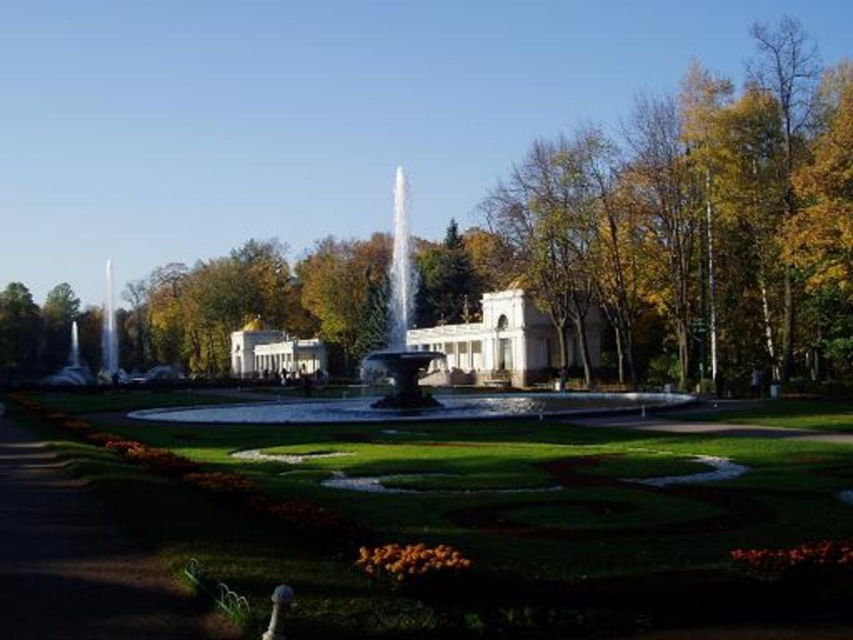
Question: Which point is closer to the camera?

Choices:
 (A) green grass at lower left
 (B) shiny silver fountain at center

Answer: (A)

Question: Is the position of green grass at lower left less distant than that of shiny silver fountain at center?

Choices:
 (A) yes
 (B) no

Answer: (A)

Question: Can you confirm if green grass at lower left is thinner than shiny silver fountain at center?

Choices:
 (A) yes
 (B) no

Answer: (B)

Question: Which point is closer to the camera?

Choices:
 (A) (20, 429)
 (B) (399, 340)

Answer: (A)

Question: Which object is farther from the camera taking this photo?

Choices:
 (A) green grass at lower left
 (B) shiny silver fountain at center

Answer: (B)

Question: Is green grass at lower left to the left of shiny silver fountain at center from the viewer's perspective?

Choices:
 (A) no
 (B) yes

Answer: (B)